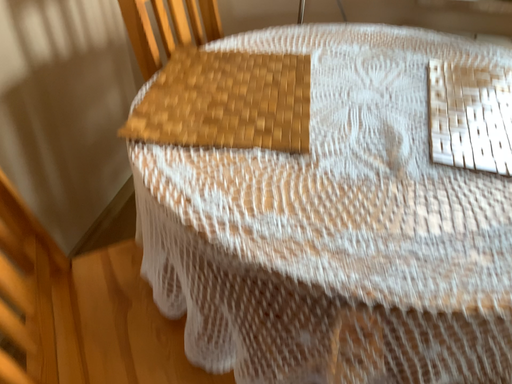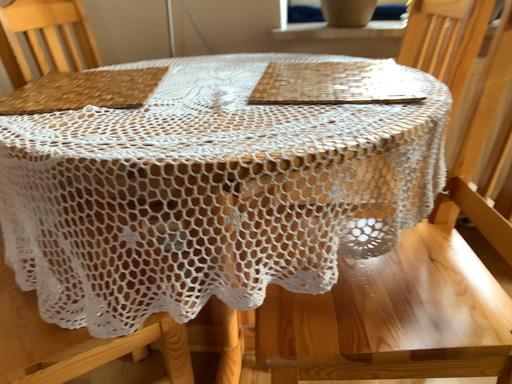
Question: How did the camera likely rotate when shooting the video?

Choices:
 (A) rotated downward
 (B) rotated upward

Answer: (B)